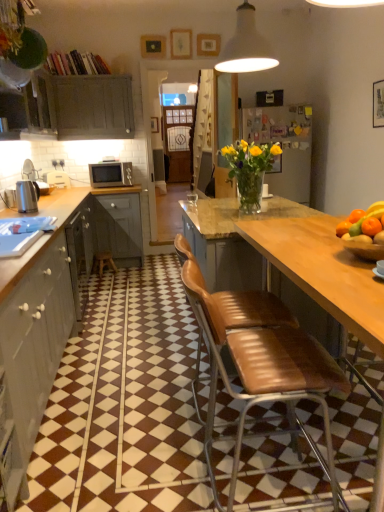
At what (x,y) coordinates should I click in order to perform the action: click on vacant area situated to the left side of brown leather chair at center, positioned as the 1th chair in front-to-back order. Please return your answer as a coordinate pair (x, y). This screenshot has width=384, height=512. Looking at the image, I should click on (153, 474).